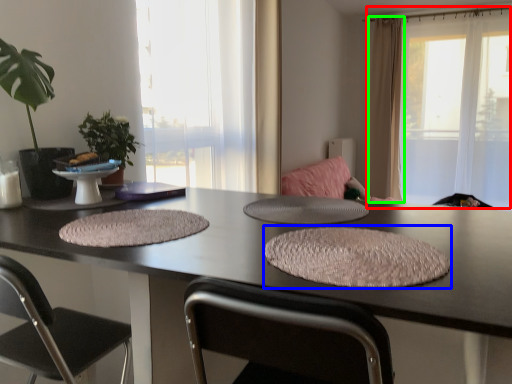
Question: Estimate the real-world distances between objects in this image. Which object is farther from window (highlighted by a red box), yoga mat (highlighted by a blue box) or curtain (highlighted by a green box)?

Choices:
 (A) yoga mat
 (B) curtain

Answer: (A)